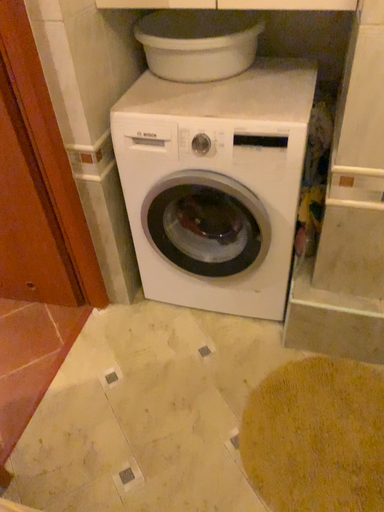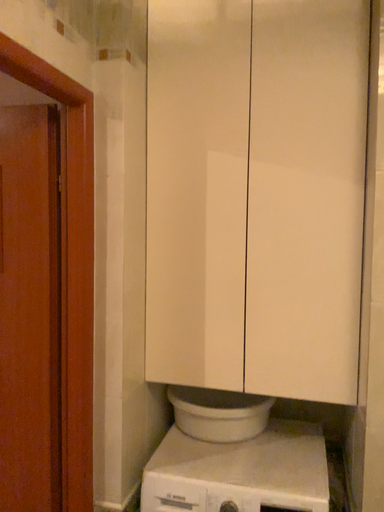
Question: Which way did the camera rotate in the video?

Choices:
 (A) rotated upward
 (B) rotated downward

Answer: (A)